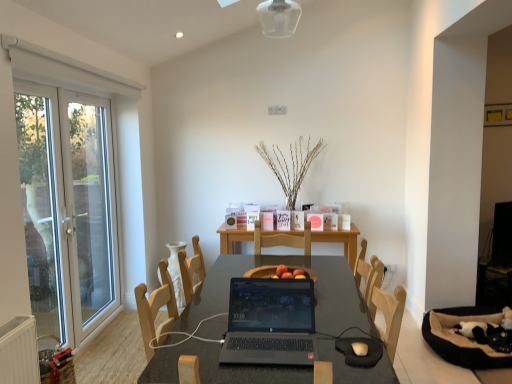
Find the location of a particular element. Image resolution: width=512 pixels, height=384 pixels. vacant space in front of matte white mouse at center is located at coordinates (367, 370).